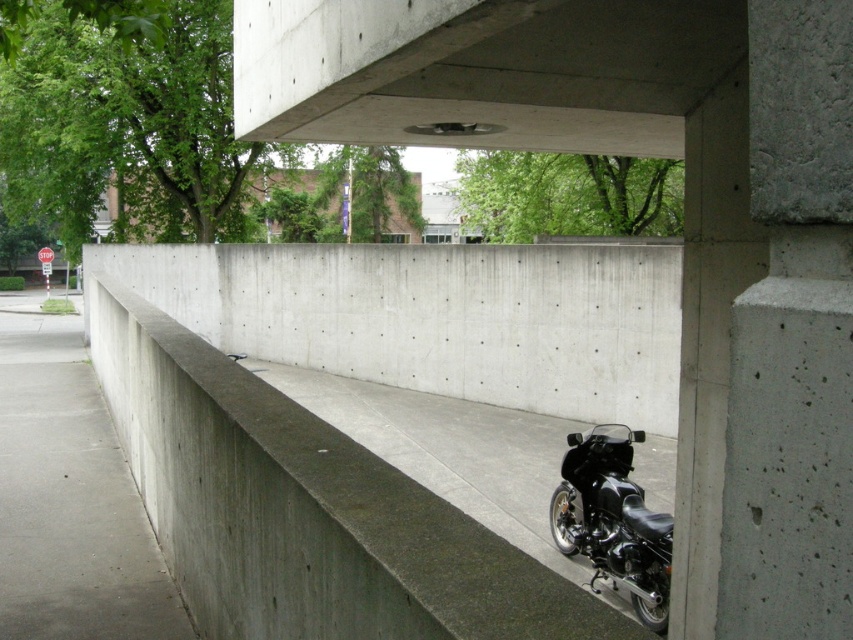
Which is above, concrete at lower right or concrete at upper center?

concrete at upper center is above.

Can you confirm if concrete at lower right is bigger than concrete at upper center?

Actually, concrete at lower right might be smaller than concrete at upper center.

Is point (277, 476) positioned in front of point (660, 61)?

That is True.

Locate an element on the screen. The height and width of the screenshot is (640, 853). concrete at lower right is located at coordinates (305, 509).

Does concrete at upper center come in front of black matte motorcycle at lower right?

Yes, it is.

Does concrete at upper center have a lesser height compared to black matte motorcycle at lower right?

Correct, concrete at upper center is not as tall as black matte motorcycle at lower right.

Identify the location of concrete at upper center. (480, 72).

Who is shorter, concrete at lower right or black matte motorcycle at lower right?

Standing shorter between the two is concrete at lower right.

Can you confirm if concrete at lower right is bigger than black matte motorcycle at lower right?

No, concrete at lower right is not bigger than black matte motorcycle at lower right.

Identify the location of concrete at lower right. This screenshot has width=853, height=640. (305, 509).

The width and height of the screenshot is (853, 640). What are the coordinates of `concrete at lower right` in the screenshot? It's located at (305, 509).